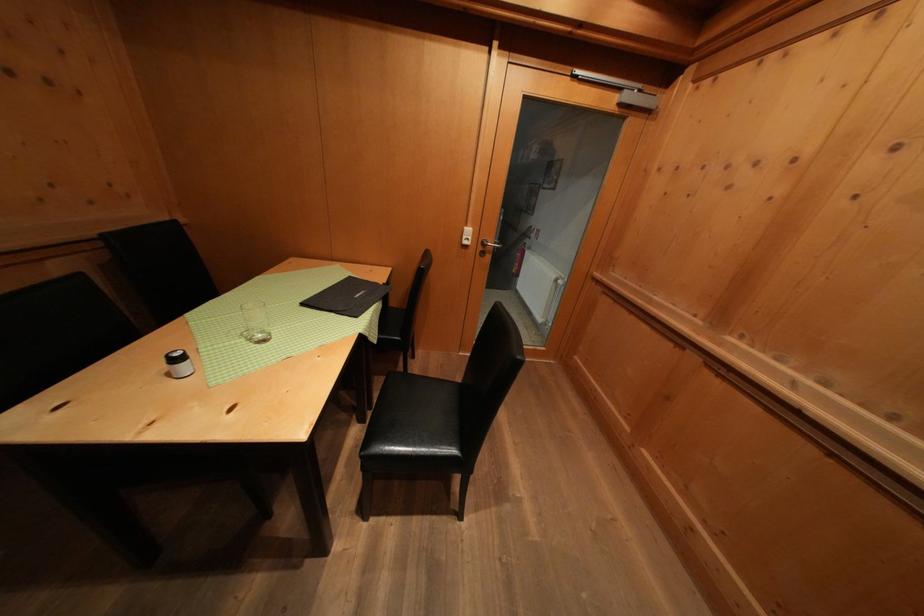
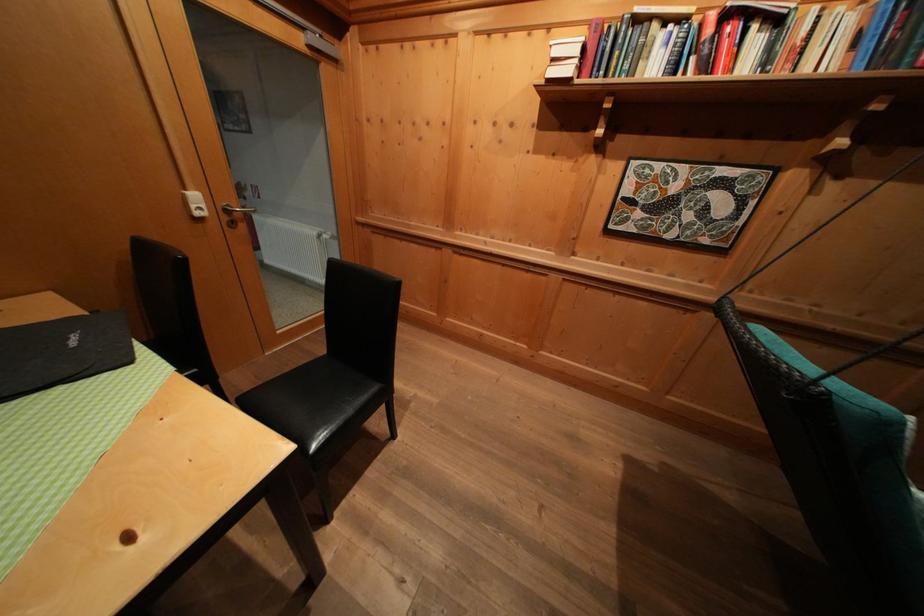
The images are taken continuously from a first-person perspective. In which direction is your viewpoint rotating?

The camera rotated toward right-down.